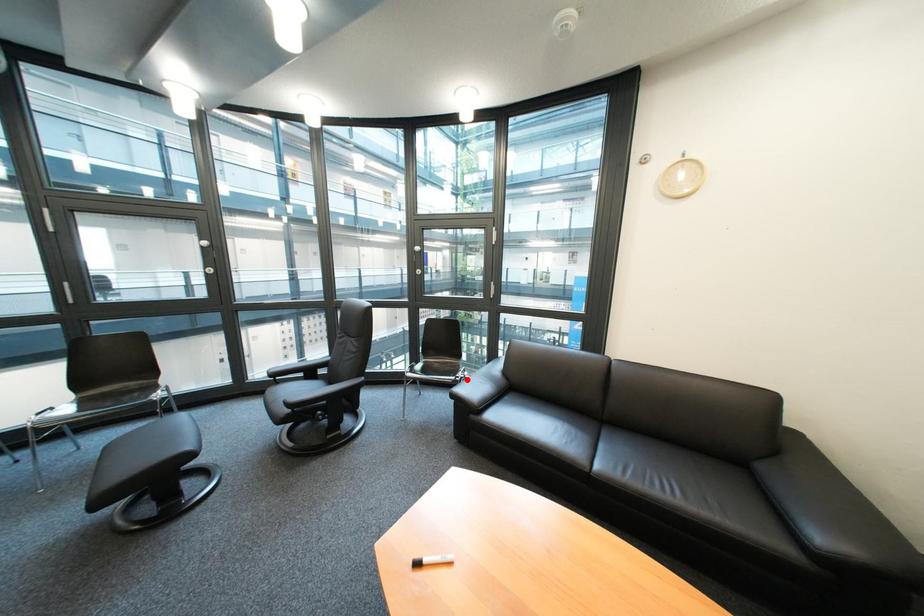
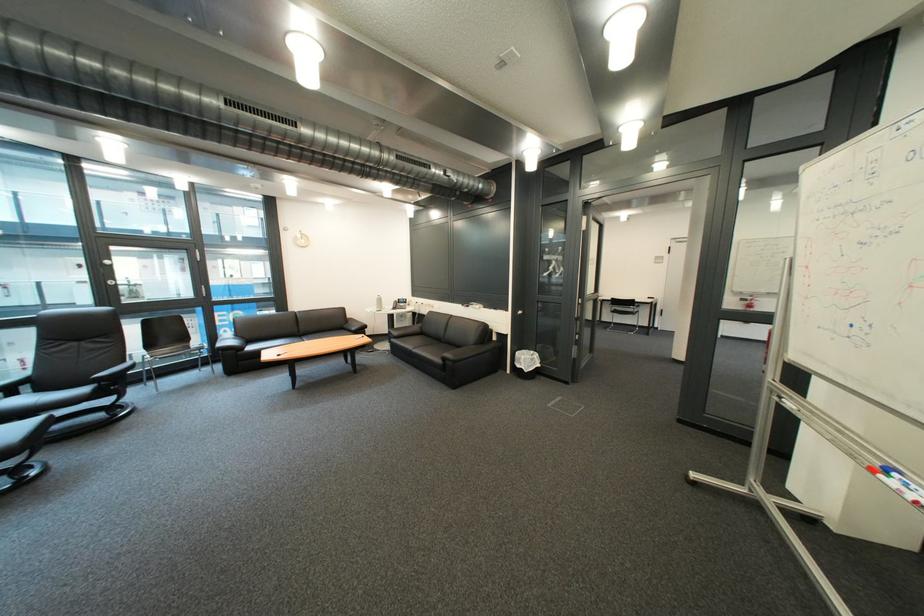
Locate, in the second image, the point that corresponds to the highlighted location in the first image.

(220, 347)